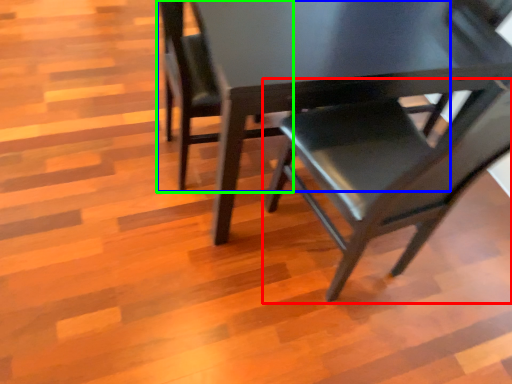
Question: Which object is the farthest from chair (highlighted by a red box)? Choose among these: chair (highlighted by a blue box) or chair (highlighted by a green box).

Choices:
 (A) chair
 (B) chair

Answer: (A)